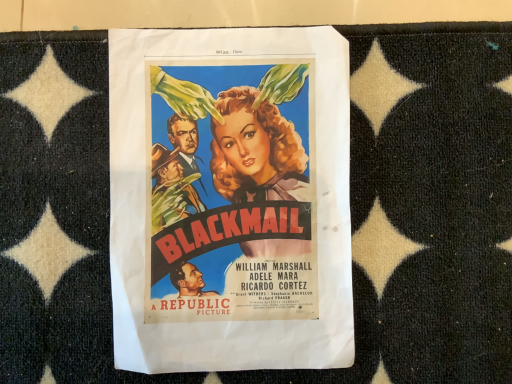
Question: Should I look upward or downward to see matte paper poster at center?

Choices:
 (A) down
 (B) up

Answer: (A)